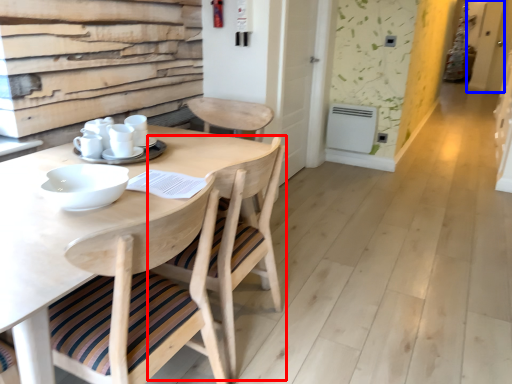
Question: Which of the following is the farthest to the observer, chair (highlighted by a red box) or screen door (highlighted by a blue box)?

Choices:
 (A) chair
 (B) screen door

Answer: (B)